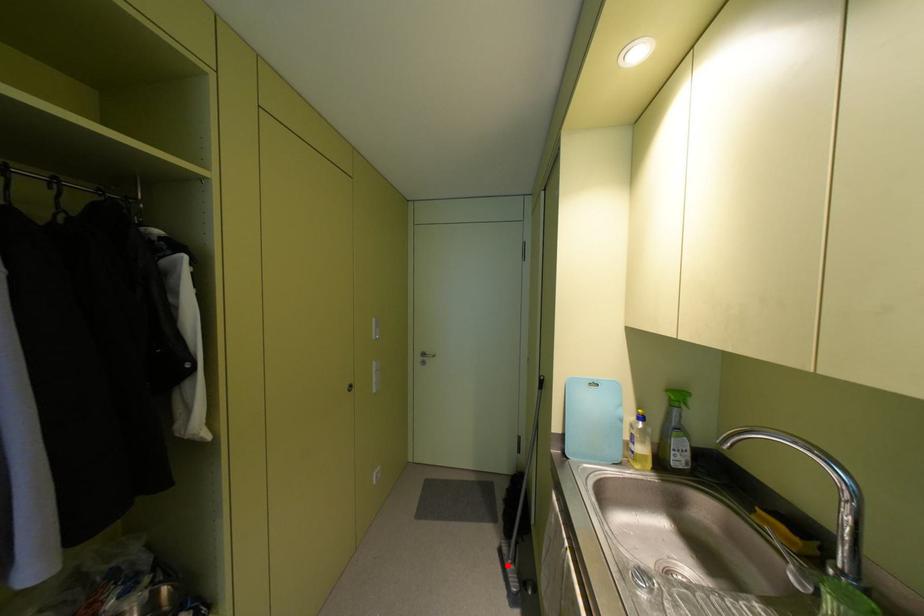
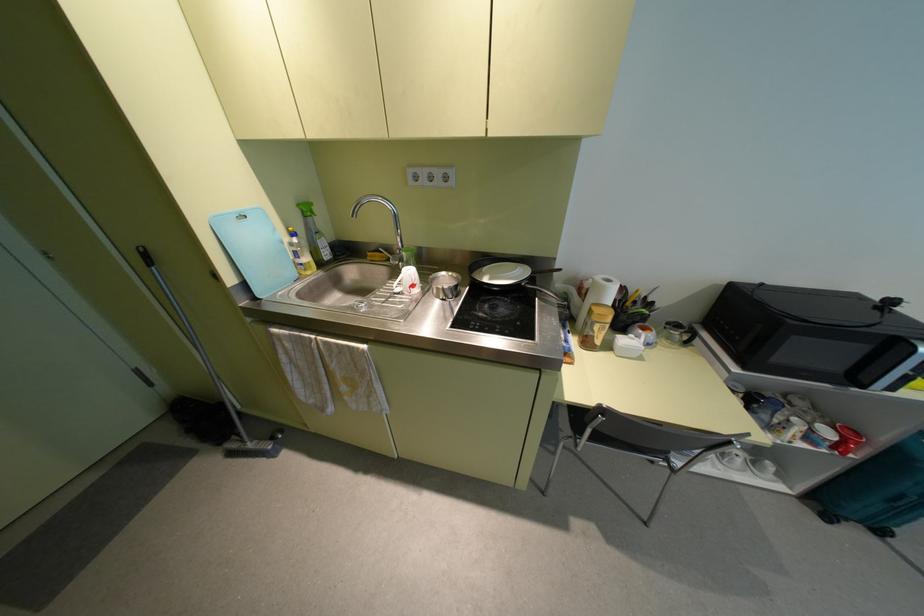
Find the pixel in the second image that matches the highlighted location in the first image.

(250, 445)